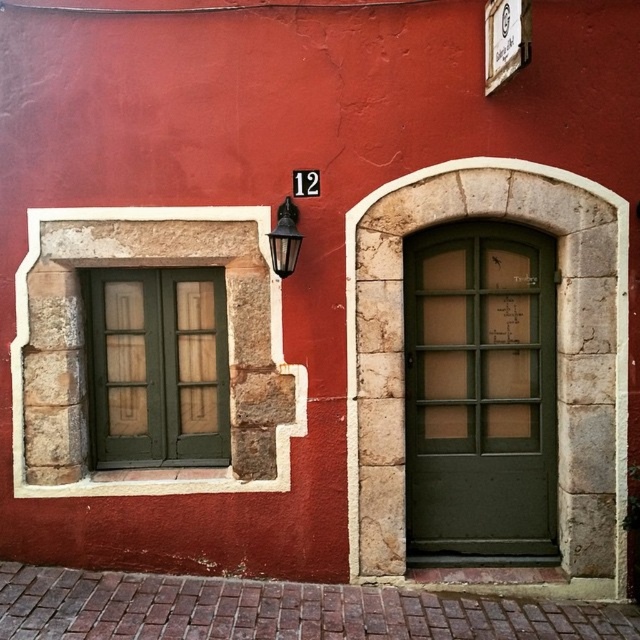
Question: Can you confirm if green stone door at right is positioned to the right of green wood window at left?

Choices:
 (A) no
 (B) yes

Answer: (B)

Question: Considering the real-world distances, which object is closest to the green matte door at center?

Choices:
 (A) green wood window at left
 (B) matte glass lamp at upper center
 (C) green stone door at right

Answer: (C)

Question: Which object appears farthest from the camera in this image?

Choices:
 (A) green stone door at right
 (B) green matte door at center
 (C) green wood window at left
 (D) matte glass lamp at upper center

Answer: (B)

Question: Among these points, which one is nearest to the camera?

Choices:
 (A) (x=198, y=403)
 (B) (x=406, y=413)

Answer: (B)

Question: Can you confirm if green stone door at right is thinner than matte glass lamp at upper center?

Choices:
 (A) no
 (B) yes

Answer: (A)

Question: Does green matte door at center lie in front of green wood window at left?

Choices:
 (A) no
 (B) yes

Answer: (A)